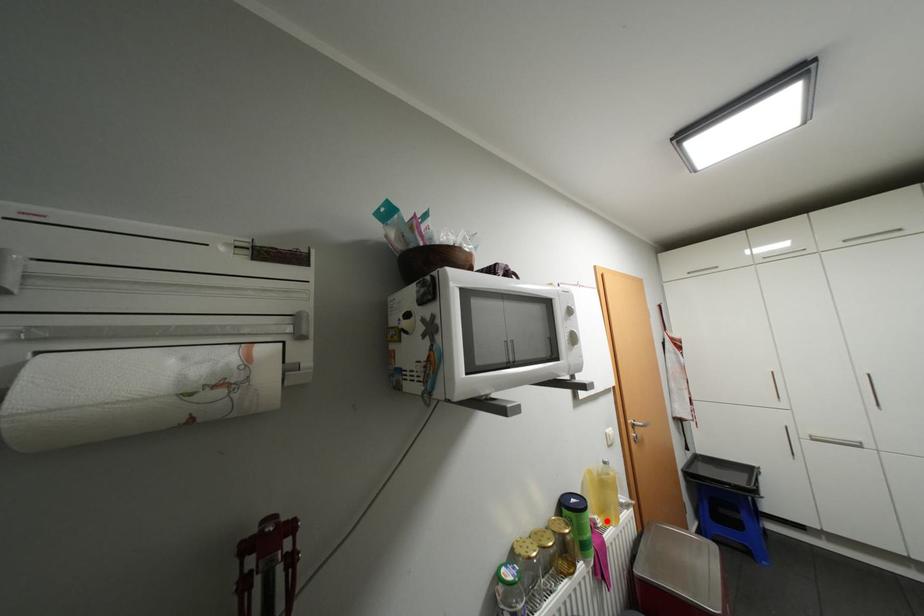
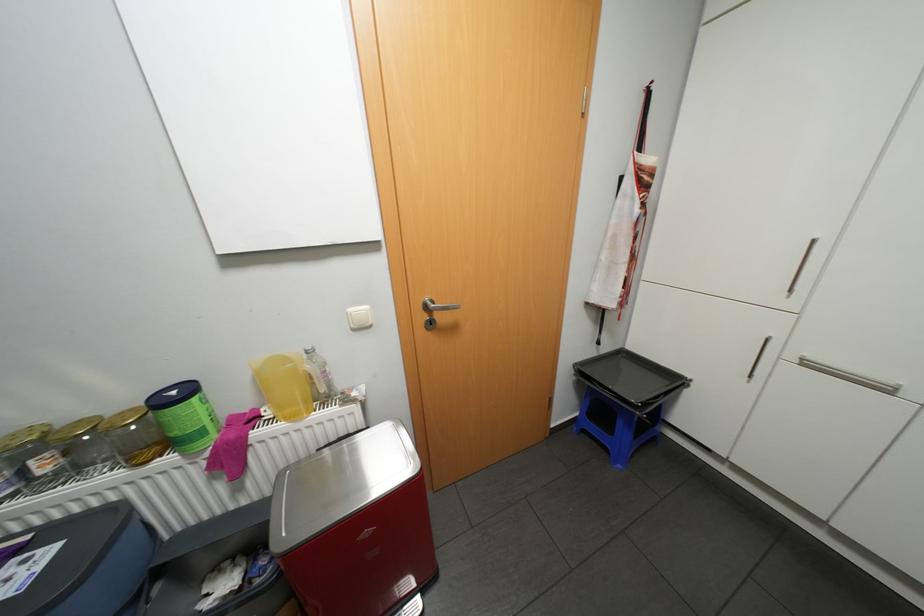
Question: A red point is marked in image1. In image2, is the corresponding 3D point closer to the camera or farther? Reply with the corresponding letter.

Choices:
 (A) The corresponding 3D point is closer.
 (B) The corresponding 3D point is farther.

Answer: (A)